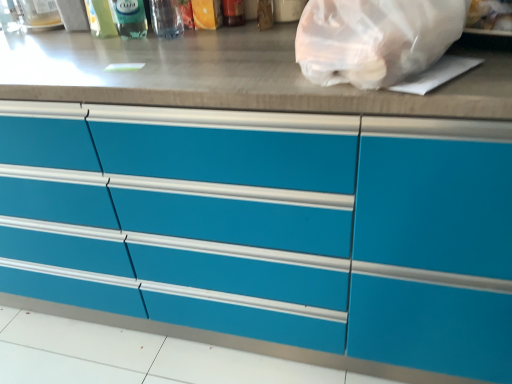
The width and height of the screenshot is (512, 384). I want to click on vacant space situated on the left part of transparent plastic bottle at upper left, which is the 2th bottle in left-to-right order, so click(75, 41).